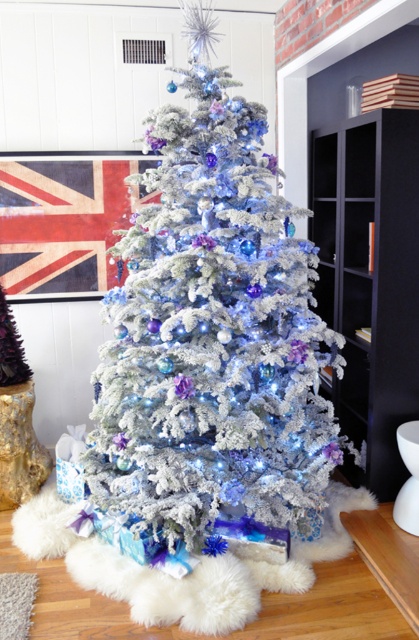
Is frosted white christmas tree at center shorter than black matte bookshelf at right?

No, frosted white christmas tree at center is not shorter than black matte bookshelf at right.

Is frosted white christmas tree at center to the right of black matte bookshelf at right from the viewer's perspective?

Incorrect, frosted white christmas tree at center is not on the right side of black matte bookshelf at right.

Between point (167, 186) and point (383, 464), which one is positioned behind?

Positioned behind is point (383, 464).

What are the coordinates of `frosted white christmas tree at center` in the screenshot? It's located at (214, 340).